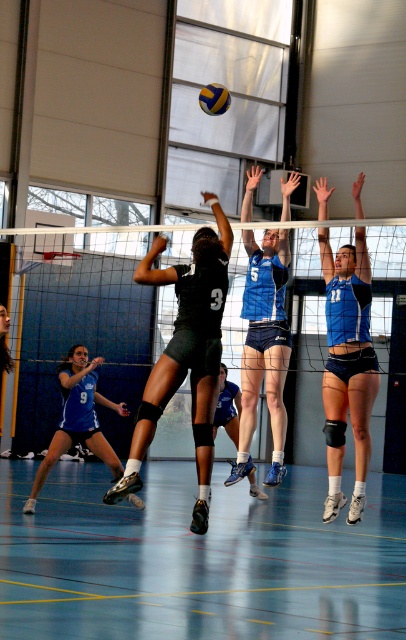
Can you confirm if blue uniform at center is positioned to the left of blue jersey at lower left?

No, blue uniform at center is not to the left of blue jersey at lower left.

Between point (334, 387) and point (25, 504), which one is positioned in front?

Positioned in front is point (334, 387).

Where is `blue uniform at center`? The height and width of the screenshot is (640, 406). blue uniform at center is located at coordinates (347, 365).

Is blue jersey at lower left closer to the viewer compared to yellow matte volleyball at center?

Yes, blue jersey at lower left is in front of yellow matte volleyball at center.

Is blue jersey at lower left above yellow matte volleyball at center?

No.

Identify the location of blue jersey at lower left. (77, 419).

Identify the location of blue jersey at lower left. The width and height of the screenshot is (406, 640). (77, 419).

Which is more to the right, smooth wooden floor at center or blue jersey at center?

blue jersey at center

Is point (365, 609) farther from viewer compared to point (256, 275)?

No, (365, 609) is closer to viewer.

Between point (393, 545) and point (274, 356), which one is positioned behind?

The point (393, 545) is more distant.

Locate an element on the screen. smooth wooden floor at center is located at coordinates (198, 560).